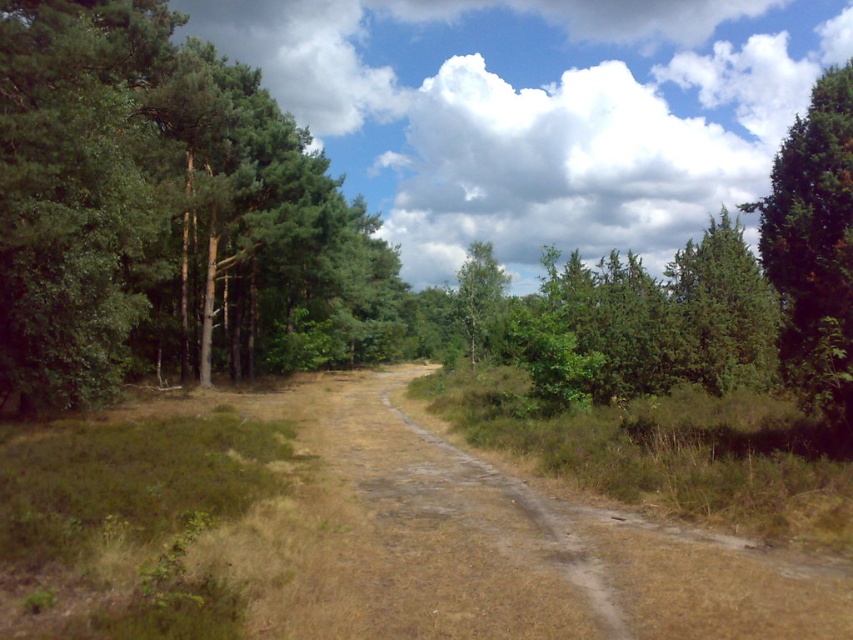
You are a hiker walking along the dirt path in the forest scene. You notice two trees ahead of you. Which one is positioned to the right side of the other? The two trees are the green textured tree at right and the green leafy tree at center.

The green textured tree at right is positioned to the right of the green leafy tree at center.

You are standing on the dirt path in the forest scene. You notice two points marked in the image. The first point is at coordinate point (61, 314) and the second is at point (764, 305). Which point is closer to you as you stand on the path?

Point (61, 314) is closer to you than point (764, 305) because it is positioned closer to the camera in the image.